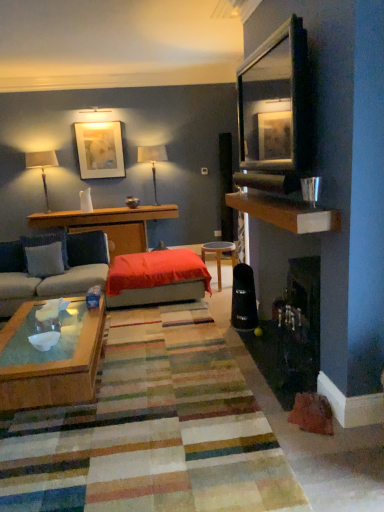
Question: Is the depth of clear glass cup at upper right greater than that of wooden shelf at upper right?

Choices:
 (A) yes
 (B) no

Answer: (A)

Question: Are clear glass cup at upper right and wooden shelf at upper right far apart?

Choices:
 (A) no
 (B) yes

Answer: (A)

Question: Considering the relative positions of clear glass cup at upper right and wooden shelf at upper right in the image provided, is clear glass cup at upper right in front of wooden shelf at upper right?

Choices:
 (A) no
 (B) yes

Answer: (A)

Question: Is clear glass cup at upper right facing towards wooden shelf at upper right?

Choices:
 (A) yes
 (B) no

Answer: (B)

Question: From the image's perspective, is clear glass cup at upper right located above wooden shelf at upper right?

Choices:
 (A) no
 (B) yes

Answer: (A)

Question: Can you confirm if clear glass cup at upper right is thinner than wooden shelf at upper right?

Choices:
 (A) no
 (B) yes

Answer: (B)

Question: From a real-world perspective, is matte white picture frame at upper center beneath white glossy bowl at center?

Choices:
 (A) yes
 (B) no

Answer: (B)

Question: Would you say white glossy bowl at center is part of matte white picture frame at upper center's contents?

Choices:
 (A) no
 (B) yes

Answer: (A)

Question: Is matte white picture frame at upper center bigger than white glossy bowl at center?

Choices:
 (A) yes
 (B) no

Answer: (A)

Question: From the image's perspective, is matte white picture frame at upper center over white glossy bowl at center?

Choices:
 (A) yes
 (B) no

Answer: (A)

Question: Is matte white picture frame at upper center outside white glossy bowl at center?

Choices:
 (A) yes
 (B) no

Answer: (A)

Question: Does matte white picture frame at upper center have a lesser height compared to white glossy bowl at center?

Choices:
 (A) no
 (B) yes

Answer: (A)

Question: Considering the relative sizes of light blue fabric pillow at left, marked as the 1th pillow in a front-to-back arrangement, and velvet red ottoman at center in the image provided, is light blue fabric pillow at left, marked as the 1th pillow in a front-to-back arrangement, thinner than velvet red ottoman at center?

Choices:
 (A) no
 (B) yes

Answer: (B)